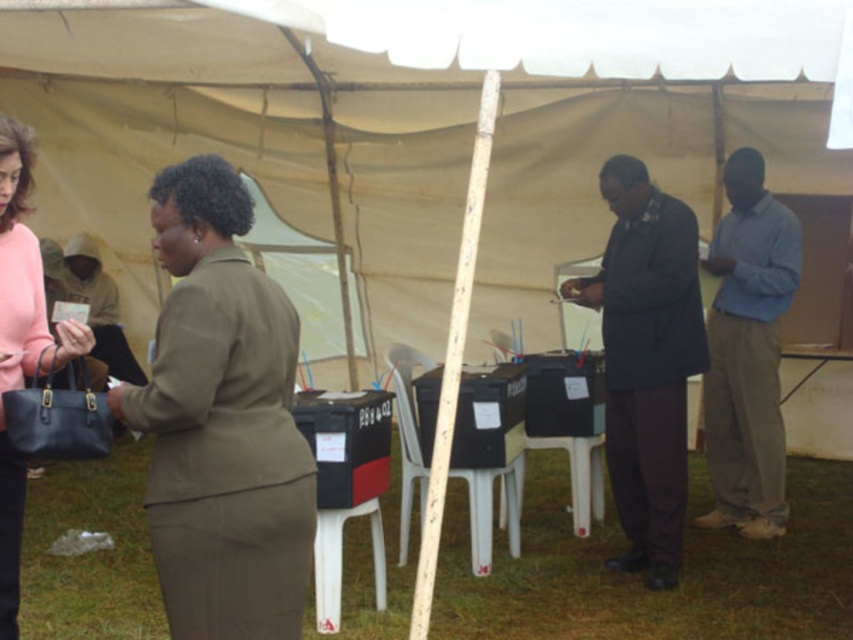
Question: Is dark brown suit at center to the right of blue cotton shirt at right from the viewer's perspective?

Choices:
 (A) yes
 (B) no

Answer: (B)

Question: Which object is farther from the camera taking this photo?

Choices:
 (A) dark brown suit at center
 (B) matte khaki suit at center

Answer: (A)

Question: Does matte khaki suit at center have a greater width compared to pink fabric purse at left?

Choices:
 (A) yes
 (B) no

Answer: (A)

Question: Which object is positioned closest to the matte khaki suit at center?

Choices:
 (A) blue cotton shirt at right
 (B) dark brown suit at center

Answer: (B)

Question: Is dark brown suit at center below pink fabric purse at left?

Choices:
 (A) yes
 (B) no

Answer: (B)

Question: Estimate the real-world distances between objects in this image. Which object is farther from the blue cotton shirt at right?

Choices:
 (A) pink fabric purse at left
 (B) matte khaki suit at center

Answer: (A)